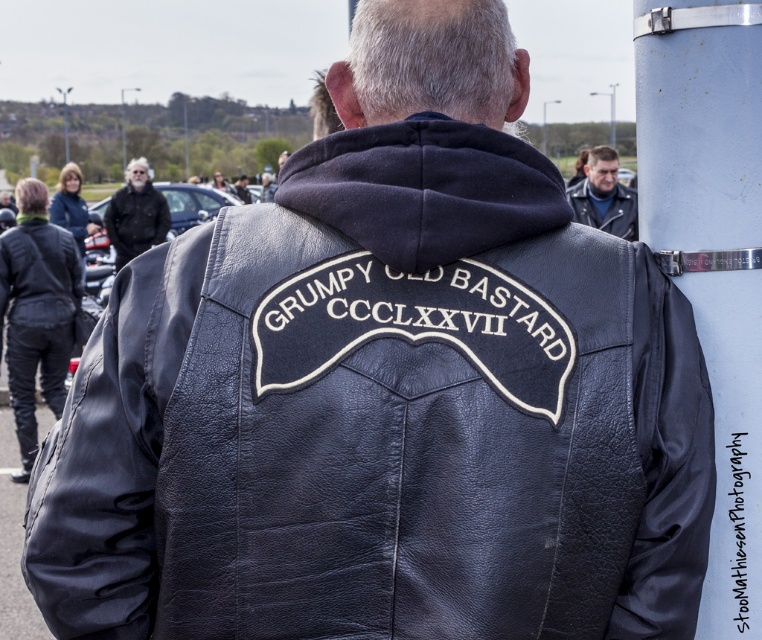
Question: Does black leather jacket at left come in front of leather jacket at upper center?

Choices:
 (A) yes
 (B) no

Answer: (A)

Question: Can you confirm if black leather jacket at upper left is positioned to the right of gray hair at upper left?

Choices:
 (A) yes
 (B) no

Answer: (A)

Question: Is gray hair at upper left to the right of leather jacket at upper center from the viewer's perspective?

Choices:
 (A) yes
 (B) no

Answer: (B)

Question: Which is farther from the gray hair at upper left?

Choices:
 (A) black leather jacket at upper left
 (B) leather jacket at upper center
 (C) black leather jacket at left

Answer: (B)

Question: Among these points, which one is farthest from the camera?

Choices:
 (A) (126, 515)
 (B) (597, 205)
 (C) (43, 304)

Answer: (B)

Question: Which object appears farthest from the camera in this image?

Choices:
 (A) black leather jacket at left
 (B) gray hair at upper left
 (C) black leather jacket at upper left

Answer: (B)